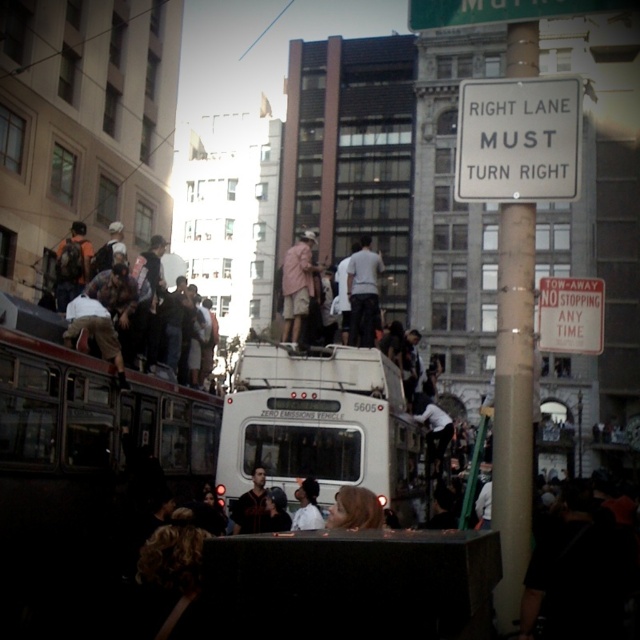
You are a photographer standing in the middle of the crowd at the protest. You want to take a photo of the white plastic sign at upper center and the matte black backpack at upper left. Which object is positioned closer to your camera?

The white plastic sign at upper center is closer to the viewer than the matte black backpack at upper left, so the sign will appear closer in the photo.

You are a photographer taking a picture of the protest scene. You have two points marked on your viewfinder at coordinates point (548, 344) and point (374, 292). Which point is closer to your camera lens?

Point (548, 344) is closer to the camera lens than point (374, 292).

You are a photographer trying to capture the entire scene of the protest. You notice the white plastic sign at upper center and the matte black backpack at upper left in your viewfinder. Which object should you adjust your focus to ensure both are clearly visible, considering their sizes?

The white plastic sign at upper center has a smaller size compared to matte black backpack at upper left. To ensure both are clearly visible, focus on the matte black backpack at upper left since it is larger and might require less adjustment to capture details.